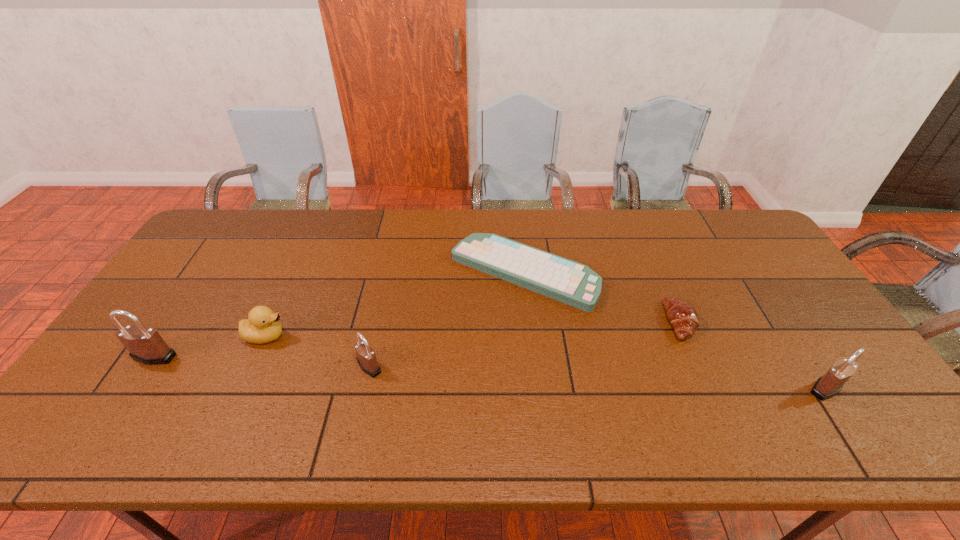
This screenshot has width=960, height=540. In order to click on free space for an extra padlock to achieve even spacing in this screenshot , I will do `click(592, 377)`.